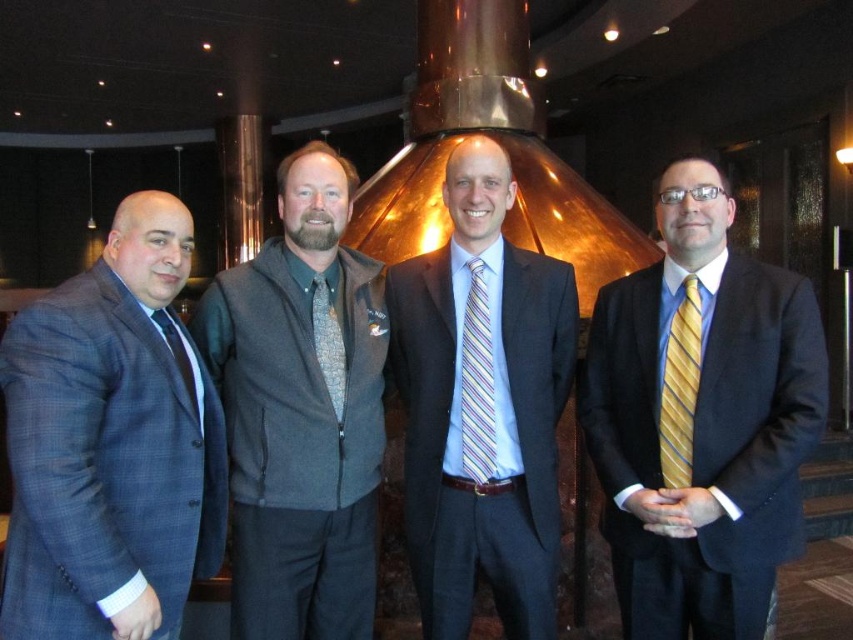
You are organizing a charity event and need to arrange items on a table. You have a gray fleece vest at center and a patterned fabric tie at center. If you want to place them side by side, which item should you place first to ensure they fit on the table?

The gray fleece vest at center should be placed first since it is wider than the patterned fabric tie at center, ensuring there is enough space for both items on the table.

You are standing at the point marked at coordinates (x=357, y=413) in the image. There are two men in dark suits. The first is on the far left wearing a dark blue suit with a white shirt and dark tie, and the second is on the right wearing a dark suit with a white shirt and yellow tie. How far apart are these two men in meters?

The two men in dark suits are 2.79 meters apart.